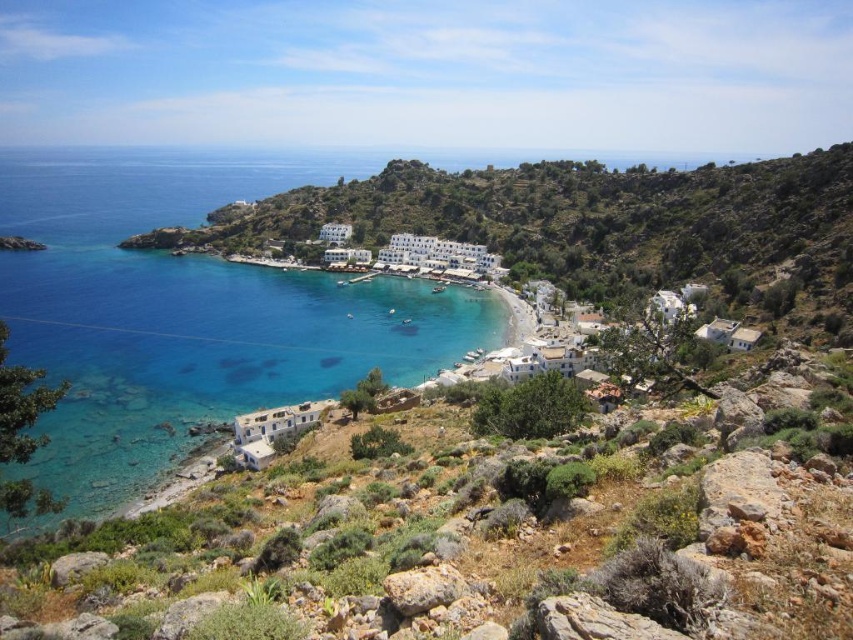
Is clear blue water at center bigger than white stone buildings at center?

Yes, clear blue water at center is bigger than white stone buildings at center.

Between clear blue water at center and white stone buildings at center, which one has more height?

clear blue water at center is taller.

Image resolution: width=853 pixels, height=640 pixels. I want to click on clear blue water at center, so click(x=189, y=312).

The height and width of the screenshot is (640, 853). What are the coordinates of `clear blue water at center` in the screenshot? It's located at (189, 312).